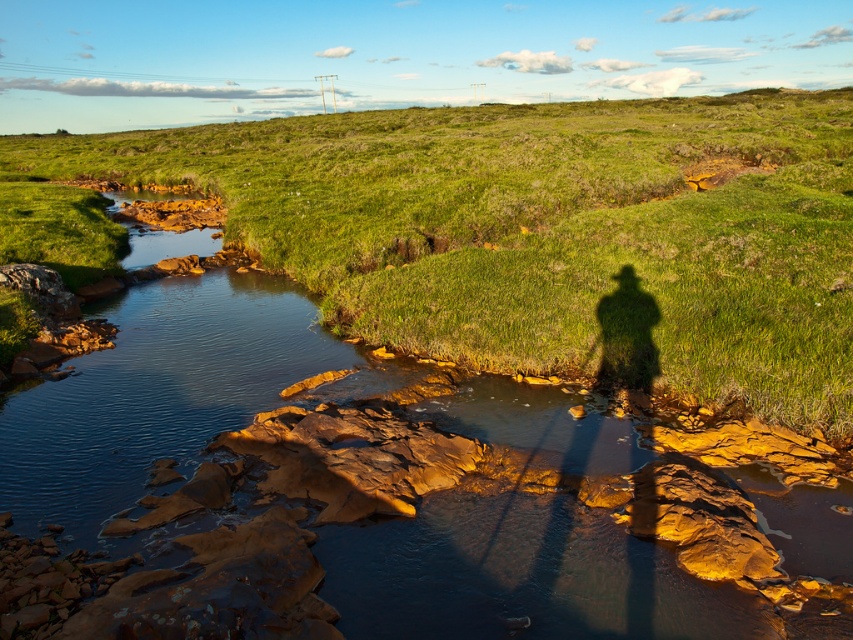
You are a hiker who wants to cross the smooth rock stream at center from the green grassy at upper center. The stream is 36.89 meters away from your current position. If you walk at a speed of 1.5 meters per second, how many seconds will it take you to reach the stream?

The distance between the green grassy at upper center and the smooth rock stream at center is 36.89 meters. At a walking speed of 1.5 meters per second, it will take approximately 24.59 seconds to reach the stream.